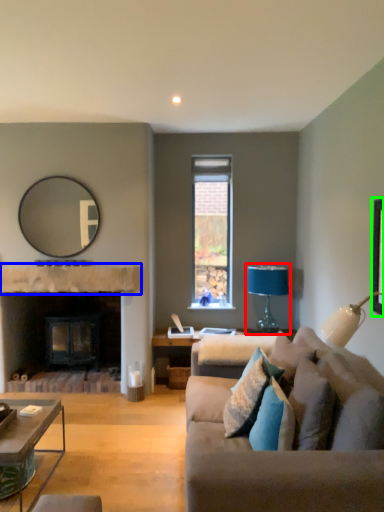
Question: Based on their relative distances, which object is nearer to table lamp (highlighted by a red box)? Choose from mantle (highlighted by a blue box) and picture frame (highlighted by a green box).

Choices:
 (A) mantle
 (B) picture frame

Answer: (A)